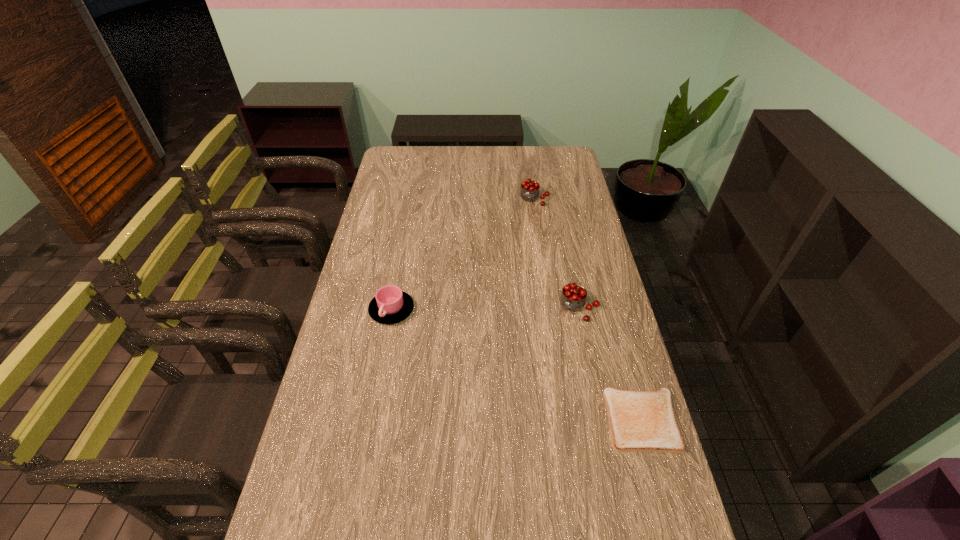
Where is `free space located on the handle side of the nearer pot filled with cherries`? Image resolution: width=960 pixels, height=540 pixels. free space located on the handle side of the nearer pot filled with cherries is located at coordinates (550, 352).

I want to click on vacant space located on the handle side of the farther pot filled with cherries, so click(516, 250).

The image size is (960, 540). What are the coordinates of `vacant space located 0.350m on the handle side of the farther pot filled with cherries` in the screenshot? It's located at (512, 262).

The height and width of the screenshot is (540, 960). Identify the location of vacant space located on the handle side of the farther pot filled with cherries. (526, 221).

Find the location of `object located in the left edge section of the desktop`. object located in the left edge section of the desktop is located at coordinates (390, 305).

Locate an element on the screen. This screenshot has height=540, width=960. toast present at the right edge is located at coordinates (640, 421).

The image size is (960, 540). I want to click on vacant area at the far edge, so click(456, 161).

I want to click on free space at the left edge of the desktop, so click(x=393, y=185).

Where is `free space at the right edge of the desktop`? This screenshot has width=960, height=540. free space at the right edge of the desktop is located at coordinates (575, 248).

Locate an element on the screen. This screenshot has height=540, width=960. vacant space at the far left corner is located at coordinates (391, 153).